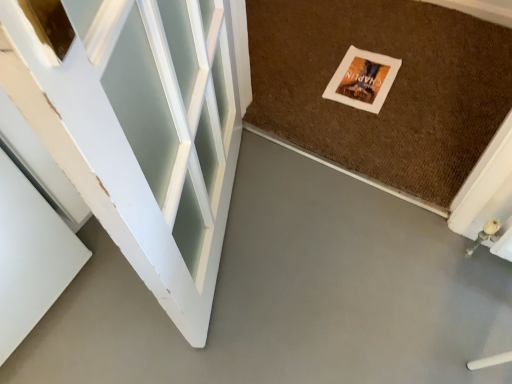
I want to click on free spot behind matte paper postcard at center, so click(351, 36).